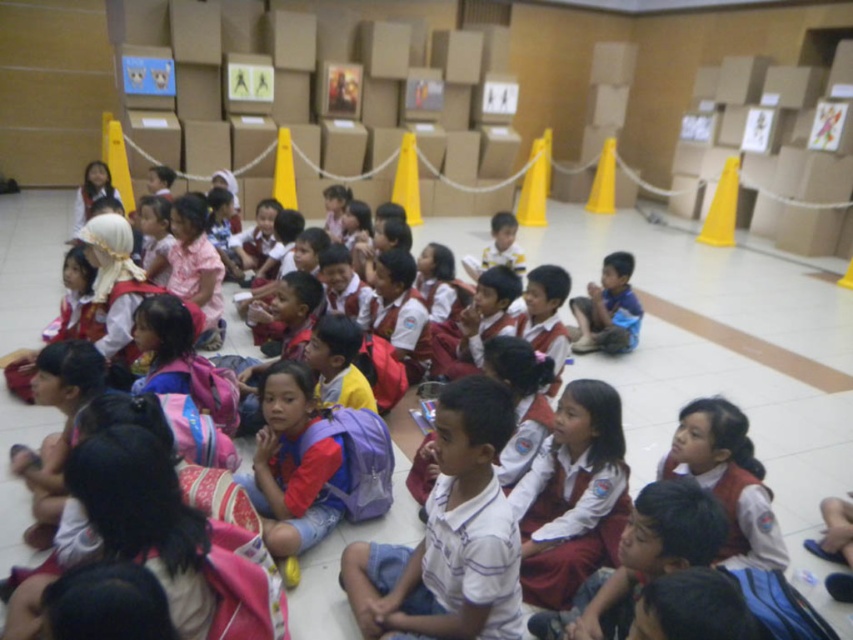
Question: Is white cotton shirt at center positioned behind blue fabric shirt at center?

Choices:
 (A) yes
 (B) no

Answer: (B)

Question: Is white cotton shirt at center bigger than blue fabric shirt at center?

Choices:
 (A) no
 (B) yes

Answer: (A)

Question: Which point is farther from the camera taking this photo?

Choices:
 (A) (459, 602)
 (B) (614, 289)

Answer: (B)

Question: Among these objects, which one is nearest to the camera?

Choices:
 (A) white cotton shirt at center
 (B) blue fabric shirt at center

Answer: (A)

Question: Which of the following is the farthest from the observer?

Choices:
 (A) white cotton shirt at center
 (B) blue fabric shirt at center

Answer: (B)

Question: Is white cotton shirt at center smaller than blue fabric shirt at center?

Choices:
 (A) yes
 (B) no

Answer: (A)